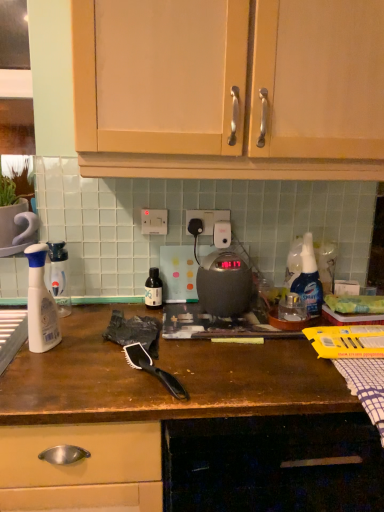
Where is `unoccupied region to the right of translucent plastic spray bottle at left`? The height and width of the screenshot is (512, 384). unoccupied region to the right of translucent plastic spray bottle at left is located at coordinates (86, 353).